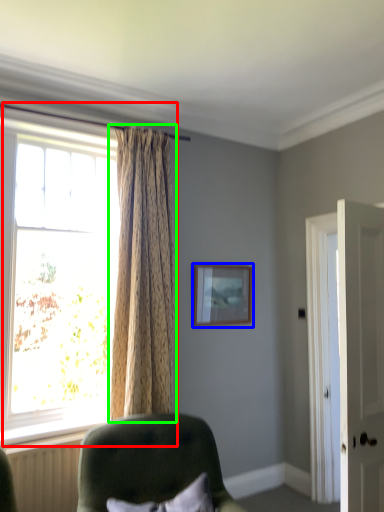
Question: Which is farther away from window (highlighted by a red box)? picture frame (highlighted by a blue box) or curtain (highlighted by a green box)?

Choices:
 (A) picture frame
 (B) curtain

Answer: (A)